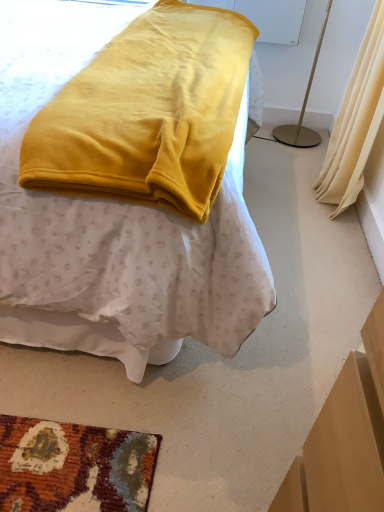
Question: Is white plastic lampshade at upper right bigger than velvet yellow blanket at center?

Choices:
 (A) no
 (B) yes

Answer: (A)

Question: Can you confirm if white plastic lampshade at upper right is taller than velvet yellow blanket at center?

Choices:
 (A) yes
 (B) no

Answer: (B)

Question: From the image's perspective, would you say white plastic lampshade at upper right is shown under velvet yellow blanket at center?

Choices:
 (A) no
 (B) yes

Answer: (A)

Question: Does white plastic lampshade at upper right turn towards velvet yellow blanket at center?

Choices:
 (A) yes
 (B) no

Answer: (B)

Question: Is white plastic lampshade at upper right thinner than velvet yellow blanket at center?

Choices:
 (A) yes
 (B) no

Answer: (A)

Question: Considering the relative sizes of white plastic lampshade at upper right and velvet yellow blanket at center in the image provided, is white plastic lampshade at upper right shorter than velvet yellow blanket at center?

Choices:
 (A) no
 (B) yes

Answer: (B)

Question: From the image's perspective, is velvet yellow blanket at center located above white plastic lampshade at upper right?

Choices:
 (A) no
 (B) yes

Answer: (A)

Question: Can you confirm if velvet yellow blanket at center is shorter than white plastic lampshade at upper right?

Choices:
 (A) no
 (B) yes

Answer: (A)

Question: Is velvet yellow blanket at center outside white plastic lampshade at upper right?

Choices:
 (A) no
 (B) yes

Answer: (B)

Question: Considering the relative positions of velvet yellow blanket at center and white plastic lampshade at upper right in the image provided, is velvet yellow blanket at center to the right of white plastic lampshade at upper right from the viewer's perspective?

Choices:
 (A) yes
 (B) no

Answer: (B)

Question: Can you see velvet yellow blanket at center touching white plastic lampshade at upper right?

Choices:
 (A) yes
 (B) no

Answer: (B)

Question: Can white plastic lampshade at upper right be found inside velvet yellow blanket at center?

Choices:
 (A) yes
 (B) no

Answer: (B)

Question: Is velvet yellow blanket at center facing away from beige fabric curtain at right?

Choices:
 (A) no
 (B) yes

Answer: (A)